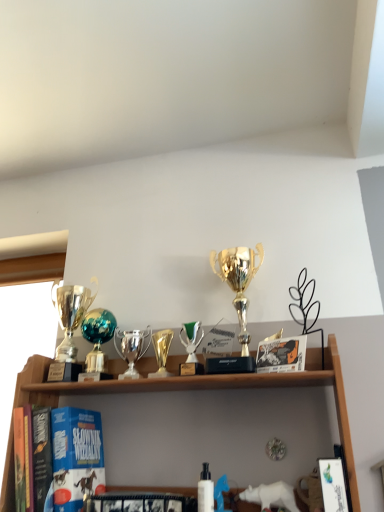
Question: Does hardcover book at center, which is the second book from right to left, lie in front of gold metallic trophy at center?

Choices:
 (A) yes
 (B) no

Answer: (A)

Question: From a real-world perspective, does hardcover book at center, which is counted as the first book, starting from the left, stand above gold metallic trophy at center?

Choices:
 (A) no
 (B) yes

Answer: (A)

Question: Considering the relative sizes of hardcover book at center, which is the second book from right to left, and gold metallic trophy at center in the image provided, is hardcover book at center, which is the second book from right to left, shorter than gold metallic trophy at center?

Choices:
 (A) yes
 (B) no

Answer: (A)

Question: Is hardcover book at center, the 2th book from the front, completely or partially outside of gold metallic trophy at center?

Choices:
 (A) yes
 (B) no

Answer: (A)

Question: From the image's perspective, would you say hardcover book at center, which is the second book from right to left, is positioned over gold metallic trophy at center?

Choices:
 (A) yes
 (B) no

Answer: (B)

Question: Considering the relative positions of white matte bottle at center and teal metallic globe at center, the 4th trophy viewed from the right, in the image provided, is white matte bottle at center to the right of teal metallic globe at center, the 4th trophy viewed from the right, from the viewer's perspective?

Choices:
 (A) no
 (B) yes

Answer: (B)

Question: Is teal metallic globe at center, the 2th trophy when ordered from left to right, a part of white matte bottle at center?

Choices:
 (A) no
 (B) yes

Answer: (A)

Question: Does white matte bottle at center have a greater width compared to teal metallic globe at center, the 2th trophy when ordered from left to right?

Choices:
 (A) yes
 (B) no

Answer: (B)

Question: Is white matte bottle at center smaller than teal metallic globe at center, the 2th trophy when ordered from left to right?

Choices:
 (A) no
 (B) yes

Answer: (B)

Question: Is white matte bottle at center thinner than teal metallic globe at center, the 4th trophy viewed from the right?

Choices:
 (A) no
 (B) yes

Answer: (B)

Question: From the image's perspective, is white matte bottle at center above teal metallic globe at center, the 2th trophy when ordered from left to right?

Choices:
 (A) no
 (B) yes

Answer: (A)

Question: Can you confirm if gold metallic trophy at center is shorter than white glossy book at lower right, which is counted as the 2th book, starting from the back?

Choices:
 (A) no
 (B) yes

Answer: (B)